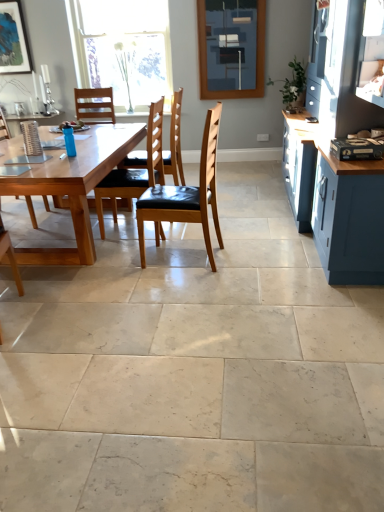
Image resolution: width=384 pixels, height=512 pixels. I want to click on free space that is to the left of brown leather chair at center, the first chair from the right, so click(x=118, y=265).